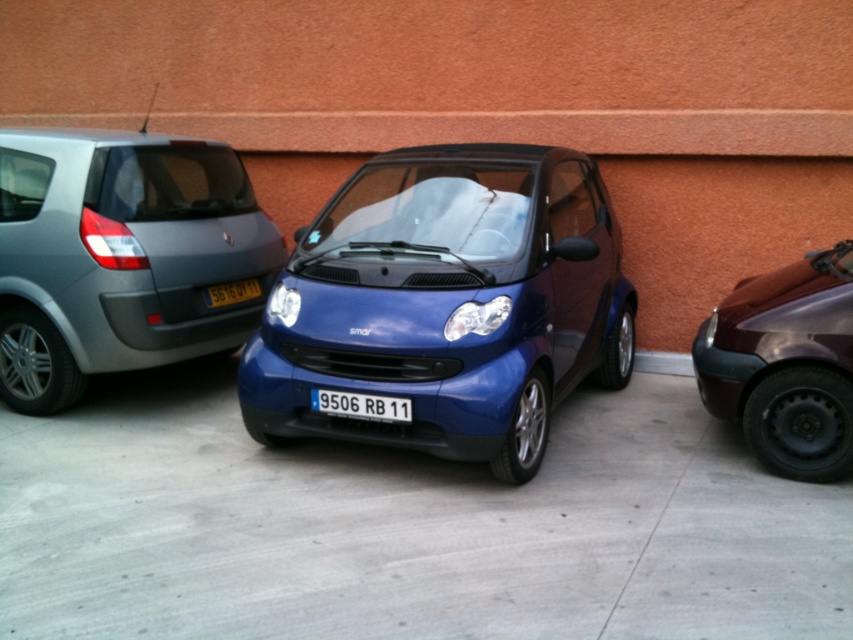
Between metallic blue car at center and blue metallic license plate at center, which one appears on the left side from the viewer's perspective?

From the viewer's perspective, blue metallic license plate at center appears more on the left side.

You are a GUI agent. You are given a task and a screenshot of the screen. Output one action in this format:
    pyautogui.click(x=<x>, y=<y>)
    Task: Click on the metallic blue car at center
    Image resolution: width=853 pixels, height=640 pixels.
    Given the screenshot: What is the action you would take?
    pyautogui.click(x=447, y=304)

The height and width of the screenshot is (640, 853). I want to click on metallic blue car at center, so click(x=447, y=304).

Is glossy maroon car at right smaller than blue metallic license plate at center?

No.

Can you confirm if glossy maroon car at right is positioned to the right of blue metallic license plate at center?

Yes, glossy maroon car at right is to the right of blue metallic license plate at center.

Who is more distant from viewer, (804,449) or (405,401)?

The point (804,449) is more distant.

At what (x,y) coordinates should I click in order to perform the action: click on glossy maroon car at right. Please return your answer as a coordinate pair (x, y). Looking at the image, I should click on (785, 364).

Does metallic blue car at center have a greater width compared to metallic gray minivan at left?

Indeed, metallic blue car at center has a greater width compared to metallic gray minivan at left.

Does metallic blue car at center have a lesser height compared to metallic gray minivan at left?

Incorrect, metallic blue car at center's height does not fall short of metallic gray minivan at left's.

Which is behind, point (396, 204) or point (73, 220)?

Point (73, 220)

You are a GUI agent. You are given a task and a screenshot of the screen. Output one action in this format:
    pyautogui.click(x=<x>, y=<y>)
    Task: Click on the metallic blue car at center
    The image size is (853, 640).
    Given the screenshot: What is the action you would take?
    (x=447, y=304)